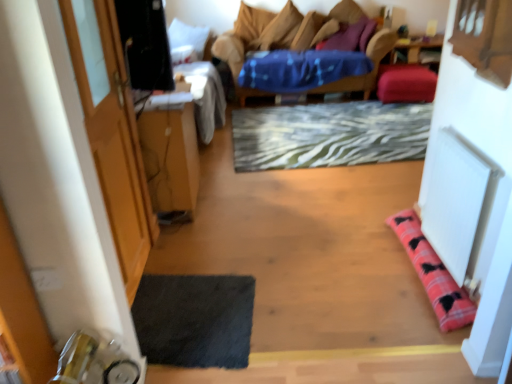
In order to click on free space that is in between wooden door at left and pink plaid pillow at lower right, placed as the 2th pillow when sorted from left to right in this screenshot , I will do `click(291, 273)`.